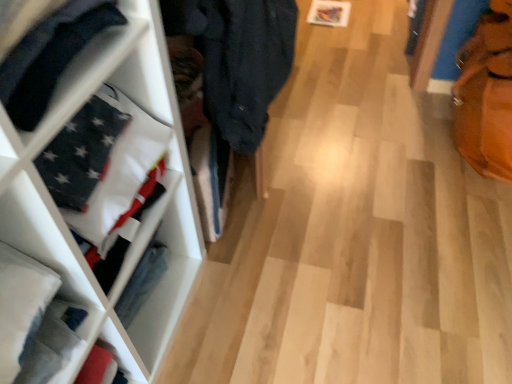
Question: Is leather textured tote bag at right next to matte black flag at left?

Choices:
 (A) no
 (B) yes

Answer: (A)

Question: Is leather textured tote bag at right at the left side of matte black flag at left?

Choices:
 (A) no
 (B) yes

Answer: (A)

Question: Is leather textured tote bag at right behind matte black flag at left?

Choices:
 (A) yes
 (B) no

Answer: (A)

Question: Can you confirm if leather textured tote bag at right is taller than matte black flag at left?

Choices:
 (A) yes
 (B) no

Answer: (A)

Question: Is leather textured tote bag at right wider than matte black flag at left?

Choices:
 (A) no
 (B) yes

Answer: (B)

Question: In terms of size, does matte black flag at left appear bigger or smaller than white fabric at left?

Choices:
 (A) big
 (B) small

Answer: (B)

Question: From the image's perspective, is matte black flag at left positioned above or below white fabric at left?

Choices:
 (A) above
 (B) below

Answer: (A)

Question: Based on their positions, is matte black flag at left located to the left or right of white fabric at left?

Choices:
 (A) right
 (B) left

Answer: (B)

Question: Considering their positions, is matte black flag at left located in front of or behind white fabric at left?

Choices:
 (A) behind
 (B) front

Answer: (B)

Question: Would you say white fabric at left is to the left or to the right of leather textured tote bag at right in the picture?

Choices:
 (A) left
 (B) right

Answer: (A)

Question: Considering their positions, is white fabric at left located in front of or behind leather textured tote bag at right?

Choices:
 (A) behind
 (B) front

Answer: (B)

Question: From the image's perspective, is white fabric at left positioned above or below leather textured tote bag at right?

Choices:
 (A) below
 (B) above

Answer: (A)

Question: In terms of height, does white fabric at left look taller or shorter compared to leather textured tote bag at right?

Choices:
 (A) tall
 (B) short

Answer: (B)

Question: Considering the positions of white fabric at left and matte black flag at left in the image, is white fabric at left taller or shorter than matte black flag at left?

Choices:
 (A) short
 (B) tall

Answer: (B)

Question: From a real-world perspective, is white fabric at left above or below matte black flag at left?

Choices:
 (A) above
 (B) below

Answer: (B)